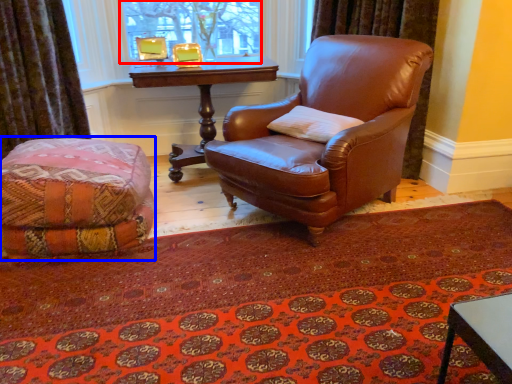
Question: Among these objects, which one is farthest to the camera, bay window (highlighted by a red box) or couch (highlighted by a blue box)?

Choices:
 (A) bay window
 (B) couch

Answer: (A)